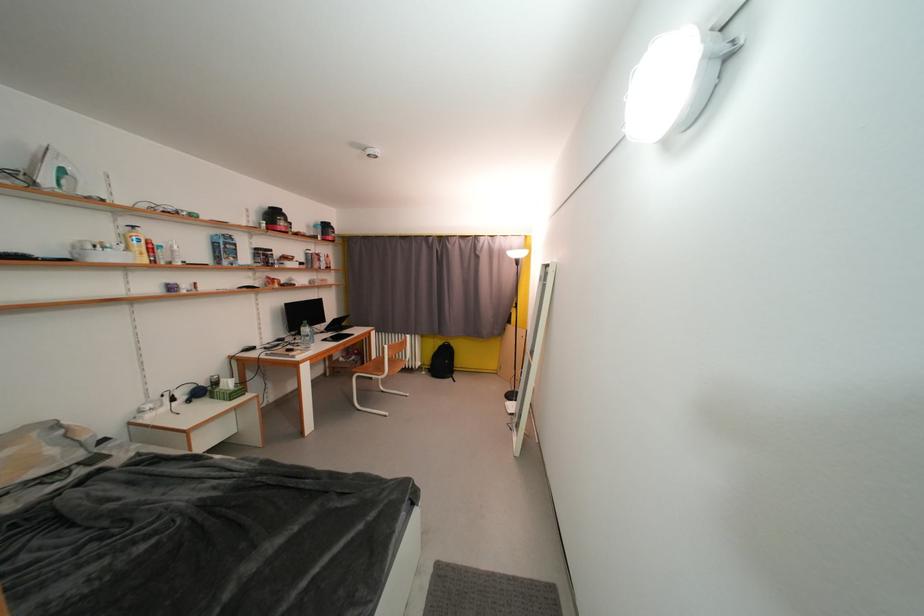
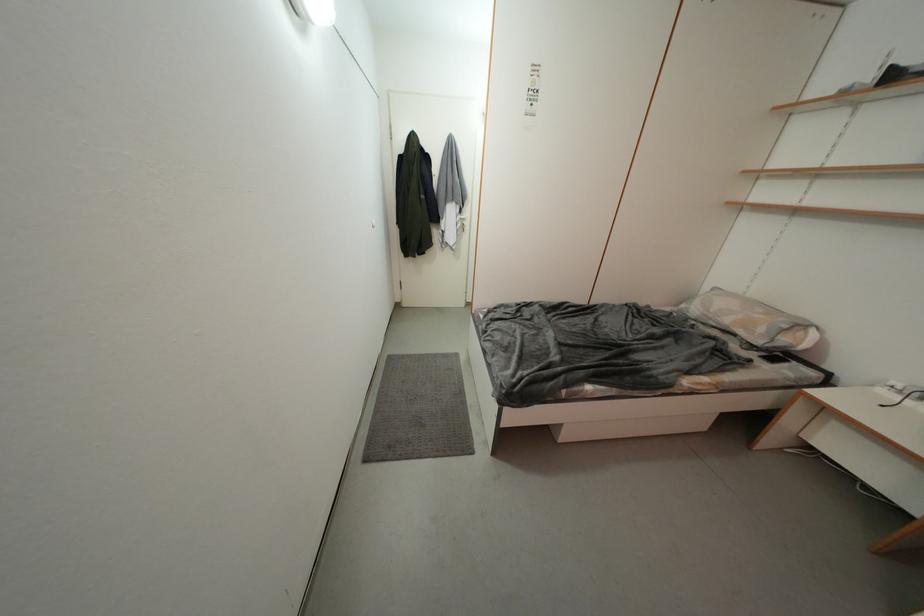
Locate, in the second image, the point that corresponds to point (61, 454) in the first image.

(769, 333)